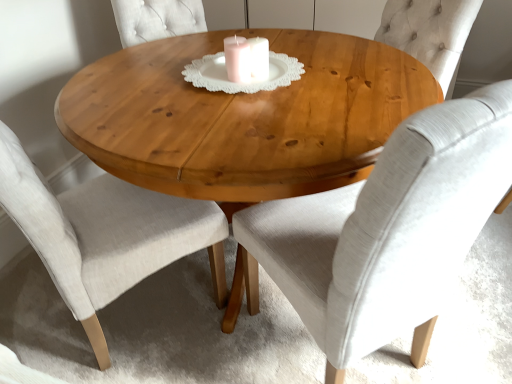
Question: From the image's perspective, is light gray fabric chair at center, which is the second chair from left to right, above or below natural wood table at center?

Choices:
 (A) below
 (B) above

Answer: (A)

Question: In the image, is light gray fabric chair at center, which is the second chair from left to right, on the left side or the right side of natural wood table at center?

Choices:
 (A) left
 (B) right

Answer: (B)

Question: Which is nearer to the light beige fabric chair at center, the second chair from the right?

Choices:
 (A) light gray fabric chair at center, which is counted as the 1th chair, starting from the right
 (B) natural wood table at center

Answer: (B)

Question: Which object is positioned farthest from the light beige fabric chair at center, positioned as the first chair in left-to-right order?

Choices:
 (A) light gray fabric chair at center, which is counted as the 1th chair, starting from the right
 (B) natural wood table at center

Answer: (A)